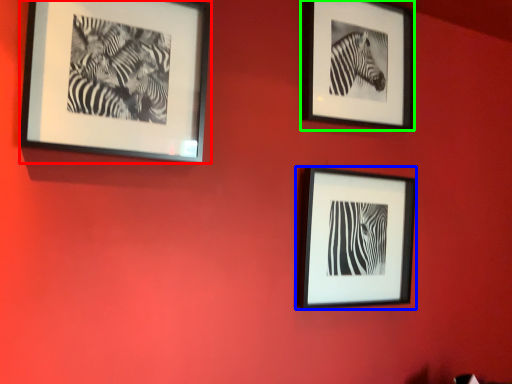
Question: Which is nearer to the picture frame (highlighted by a red box)? picture frame (highlighted by a blue box) or picture frame (highlighted by a green box).

Choices:
 (A) picture frame
 (B) picture frame

Answer: (B)